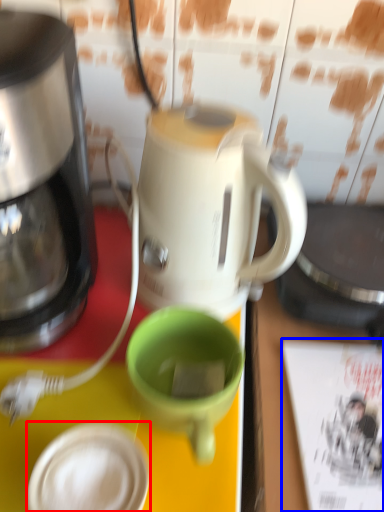
Question: Which point is closer to the camera, tableware (highlighted by a red box) or magazine (highlighted by a blue box)?

Choices:
 (A) tableware
 (B) magazine

Answer: (A)